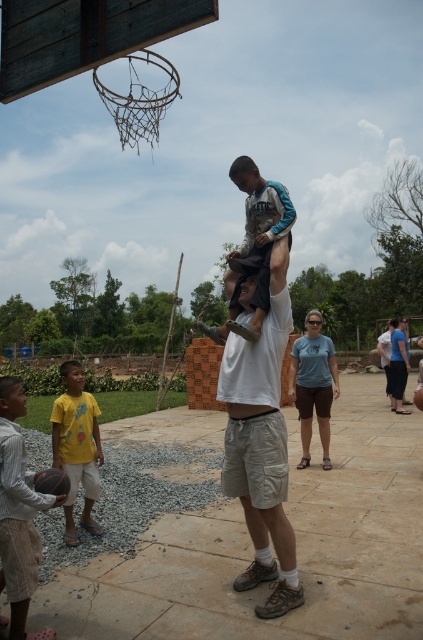
You are standing at the center of the basketball court and see two points marked on the ground. The first point is at coordinates point (227, 346) and the second point is at point (241, 253). Which point is closer to you?

Point (227, 346) is closer to the viewer than point (241, 253).

You are a basketball player trying to shoot the ball into the hoop. The hoop is behind the rusty wire mesh at upper center. Can you throw the rubber textured basketball at lower left through the mesh without touching it?

The rusty wire mesh at upper center is larger in size than the rubber textured basketball at lower left, so yes, the ball can pass through the mesh without touching it.